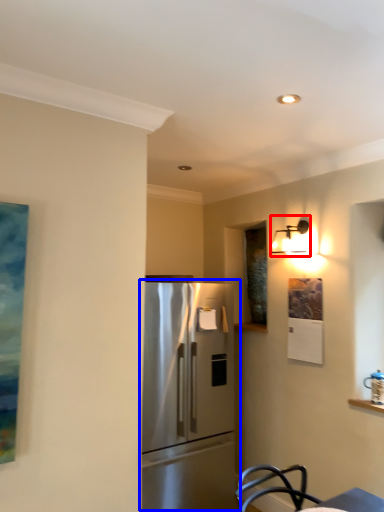
Question: Which object is further to the camera taking this photo, light fixture (highlighted by a red box) or refrigerator (highlighted by a blue box)?

Choices:
 (A) light fixture
 (B) refrigerator

Answer: (A)